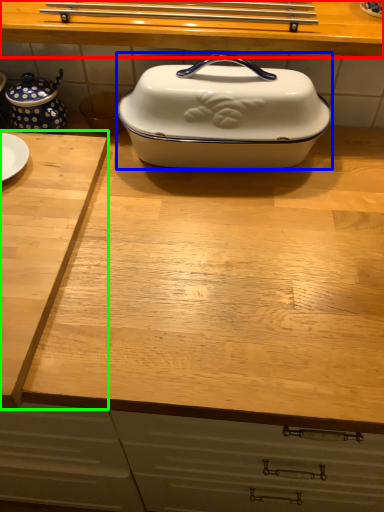
Question: Which object is the closest to the countertop (highlighted by a red box)? Choose among these: kitchen appliance (highlighted by a blue box) or cutting board (highlighted by a green box).

Choices:
 (A) kitchen appliance
 (B) cutting board

Answer: (A)